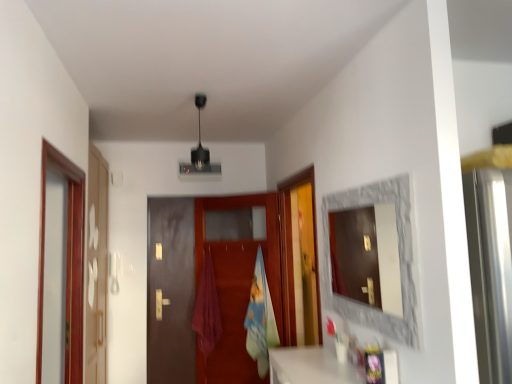
What is the approximate width of white glossy screen door at left, the 2th screen door when ordered from front to back?

5.95 inches.

At what (x,y) coordinates should I click in order to perform the action: click on pink fabric towel at center. Please return your answer as a coordinate pair (x, y). Looking at the image, I should click on (207, 309).

What do you see at coordinates (197, 287) in the screenshot? I see `brown matte door at center` at bounding box center [197, 287].

Identify the location of brown wooden screen door at left, the 2th screen door in the back-to-front sequence. This screenshot has width=512, height=384. (67, 262).

In the scene shown: Which of these two, brown wooden screen door at left, the 2th screen door in the back-to-front sequence, or white glossy screen door at left, acting as the first screen door starting from the back, stands taller?

white glossy screen door at left, acting as the first screen door starting from the back, is taller.

Can you confirm if brown wooden screen door at left, the 2th screen door in the back-to-front sequence, is wider than white glossy screen door at left, the 2th screen door when ordered from front to back?

In fact, brown wooden screen door at left, the 2th screen door in the back-to-front sequence, might be narrower than white glossy screen door at left, the 2th screen door when ordered from front to back.

Does brown wooden screen door at left, the 2th screen door in the back-to-front sequence, have a larger size compared to white glossy screen door at left, the 2th screen door when ordered from front to back?

Incorrect, brown wooden screen door at left, the 2th screen door in the back-to-front sequence, is not larger than white glossy screen door at left, the 2th screen door when ordered from front to back.

Would you say brown wooden screen door at left, which is the first screen door in front-to-back order, is inside or outside white glossy screen door at left, acting as the first screen door starting from the back?

brown wooden screen door at left, which is the first screen door in front-to-back order, cannot be found inside white glossy screen door at left, acting as the first screen door starting from the back.

Who is taller, white glossy screen door at left, the 2th screen door when ordered from front to back, or stone textured mirror at right?

white glossy screen door at left, the 2th screen door when ordered from front to back, is taller.

I want to click on the 2nd screen door behind the stone textured mirror at right, so click(97, 268).

Do you think white glossy screen door at left, acting as the first screen door starting from the back, is within stone textured mirror at right, or outside of it?

white glossy screen door at left, acting as the first screen door starting from the back, is located beyond the bounds of stone textured mirror at right.

Is white glossy screen door at left, the 2th screen door when ordered from front to back, thinner than stone textured mirror at right?

No.

From the picture: Is pink fabric towel at center taller or shorter than white glossy screen door at left, the 2th screen door when ordered from front to back?

Considering their sizes, pink fabric towel at center has less height than white glossy screen door at left, the 2th screen door when ordered from front to back.

Is white glossy screen door at left, acting as the first screen door starting from the back, at the back of pink fabric towel at center?

No, pink fabric towel at center is not facing away from white glossy screen door at left, acting as the first screen door starting from the back.

From the image's perspective, is pink fabric towel at center located beneath white glossy screen door at left, acting as the first screen door starting from the back?

Yes, from the image's perspective, pink fabric towel at center is beneath white glossy screen door at left, acting as the first screen door starting from the back.

Considering the points (204, 283) and (97, 374), which point is in front, point (204, 283) or point (97, 374)?

Positioned in front is point (97, 374).

Where is `beach towel located above the pink fabric towel at center (from the image's perspective)`? The width and height of the screenshot is (512, 384). beach towel located above the pink fabric towel at center (from the image's perspective) is located at coordinates point(260,319).

Can you confirm if blue cotton beach towel at center is bigger than pink fabric towel at center?

Yes, blue cotton beach towel at center is bigger than pink fabric towel at center.

Which point is more distant from viewer, (265, 348) or (215, 303)?

The point (215, 303) is behind.

Which of these two, blue cotton beach towel at center or pink fabric towel at center, is thinner?

pink fabric towel at center is thinner.

Considering the relative sizes of stone textured mirror at right and brown wooden screen door at left, which is the first screen door in front-to-back order, in the image provided, is stone textured mirror at right smaller than brown wooden screen door at left, which is the first screen door in front-to-back order,?

Indeed, stone textured mirror at right has a smaller size compared to brown wooden screen door at left, which is the first screen door in front-to-back order.

Between stone textured mirror at right and brown wooden screen door at left, which is the first screen door in front-to-back order, which one has larger width?

brown wooden screen door at left, which is the first screen door in front-to-back order.

Between stone textured mirror at right and brown wooden screen door at left, the 2th screen door in the back-to-front sequence, which one appears on the left side from the viewer's perspective?

brown wooden screen door at left, the 2th screen door in the back-to-front sequence.

Is stone textured mirror at right positioned far away from brown wooden screen door at left, which is the first screen door in front-to-back order?

Absolutely, stone textured mirror at right is distant from brown wooden screen door at left, which is the first screen door in front-to-back order.

Is brown wooden screen door at left, the 2th screen door in the back-to-front sequence, thinner than brown matte door at center?

No, brown wooden screen door at left, the 2th screen door in the back-to-front sequence, is not thinner than brown matte door at center.

Is brown wooden screen door at left, the 2th screen door in the back-to-front sequence, spatially inside brown matte door at center, or outside of it?

brown wooden screen door at left, the 2th screen door in the back-to-front sequence, lies outside brown matte door at center.

Find the location of a particular element. The height and width of the screenshot is (384, 512). the 2nd screen door in front of the brown matte door at center is located at coordinates (67, 262).

Does brown wooden screen door at left, the 2th screen door in the back-to-front sequence, have a smaller size compared to brown matte door at center?

Incorrect, brown wooden screen door at left, the 2th screen door in the back-to-front sequence, is not smaller in size than brown matte door at center.

Measure the distance between pink fabric towel at center and blue cotton beach towel at center.

pink fabric towel at center is 17.40 inches from blue cotton beach towel at center.

Does point (206, 334) come farther from viewer compared to point (265, 313)?

Yes, it is.

Is pink fabric towel at center oriented towards blue cotton beach towel at center?

No, pink fabric towel at center is not oriented towards blue cotton beach towel at center.

Is pink fabric towel at center far from blue cotton beach towel at center?

pink fabric towel at center is near blue cotton beach towel at center, not far away.

The image size is (512, 384). In order to click on screen door on the left of brown wooden screen door at left, the 2th screen door in the back-to-front sequence in this screenshot , I will do `click(97, 268)`.

The image size is (512, 384). Find the location of `mirror in front of the white glossy screen door at left, acting as the first screen door starting from the back`. mirror in front of the white glossy screen door at left, acting as the first screen door starting from the back is located at coordinates (399, 259).

Based on their spatial positions, is blue cotton beach towel at center or brown matte door at center closer to pink fabric towel at center?

Based on the image, brown matte door at center appears to be nearer to pink fabric towel at center.

From the image, which object appears to be nearer to brown wooden screen door at left, which is the first screen door in front-to-back order, white glossy screen door at left, acting as the first screen door starting from the back, or brown matte door at center?

white glossy screen door at left, acting as the first screen door starting from the back, lies closer to brown wooden screen door at left, which is the first screen door in front-to-back order, than the other object.

From the image, which object appears to be farther from pink fabric towel at center, brown matte door at center or white glossy screen door at left, the 2th screen door when ordered from front to back?

white glossy screen door at left, the 2th screen door when ordered from front to back, is positioned further to the anchor pink fabric towel at center.

When comparing their distances from white glossy screen door at left, the 2th screen door when ordered from front to back, does stone textured mirror at right or brown matte door at center seem closer?

The object closer to white glossy screen door at left, the 2th screen door when ordered from front to back, is brown matte door at center.

Considering their positions, is white glossy screen door at left, the 2th screen door when ordered from front to back, positioned closer to pink fabric towel at center than stone textured mirror at right?

The object closer to pink fabric towel at center is white glossy screen door at left, the 2th screen door when ordered from front to back.

From the image, which object appears to be nearer to white glossy screen door at left, acting as the first screen door starting from the back, brown wooden screen door at left, which is the first screen door in front-to-back order, or pink fabric towel at center?

brown wooden screen door at left, which is the first screen door in front-to-back order, is closer to white glossy screen door at left, acting as the first screen door starting from the back.

Considering their positions, is blue cotton beach towel at center positioned further to brown wooden screen door at left, the 2th screen door in the back-to-front sequence, than stone textured mirror at right?

stone textured mirror at right is further to brown wooden screen door at left, the 2th screen door in the back-to-front sequence.

Estimate the real-world distances between objects in this image. Which object is further from pink fabric towel at center, brown wooden screen door at left, which is the first screen door in front-to-back order, or brown matte door at center?

brown wooden screen door at left, which is the first screen door in front-to-back order.

Where is `curtain between white glossy screen door at left, the 2th screen door when ordered from front to back, and blue cotton beach towel at center, in the horizontal direction`? Image resolution: width=512 pixels, height=384 pixels. curtain between white glossy screen door at left, the 2th screen door when ordered from front to back, and blue cotton beach towel at center, in the horizontal direction is located at coordinates (207, 309).

You are a GUI agent. You are given a task and a screenshot of the screen. Output one action in this format:
    pyautogui.click(x=<x>, y=<y>)
    Task: Click on the door between white glossy screen door at left, the 2th screen door when ordered from front to back, and blue cotton beach towel at center
    
    Given the screenshot: What is the action you would take?
    pyautogui.click(x=197, y=287)

The height and width of the screenshot is (384, 512). What are the coordinates of `curtain between brown wooden screen door at left, which is the first screen door in front-to-back order, and brown matte door at center, along the z-axis` in the screenshot? It's located at (207, 309).

At what (x,y) coordinates should I click in order to perform the action: click on curtain located between stone textured mirror at right and brown matte door at center in the depth direction. Please return your answer as a coordinate pair (x, y). Looking at the image, I should click on (207, 309).